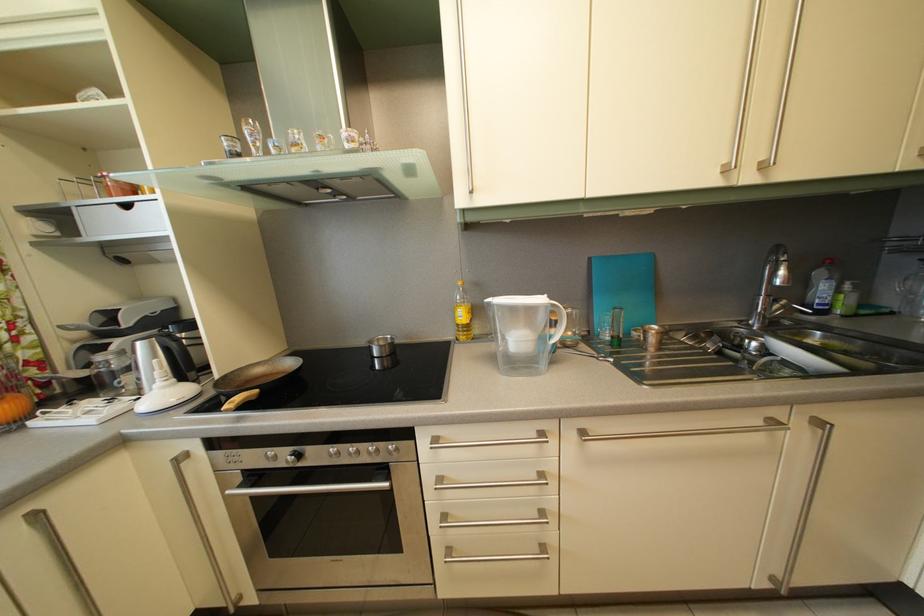
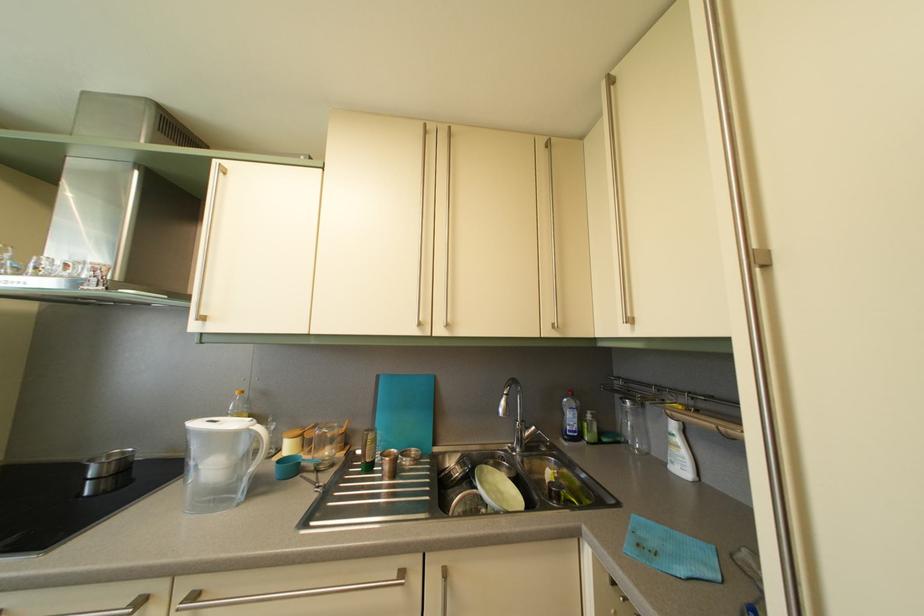
The point at (756, 185) is marked in the first image. Where is the corresponding point in the second image?

(447, 339)